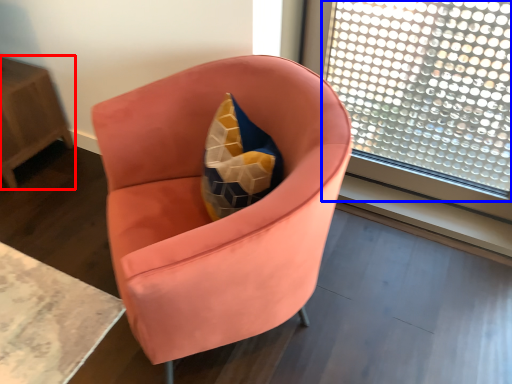
Question: Among these objects, which one is nearest to the camera, table (highlighted by a red box) or window (highlighted by a blue box)?

Choices:
 (A) table
 (B) window

Answer: (B)